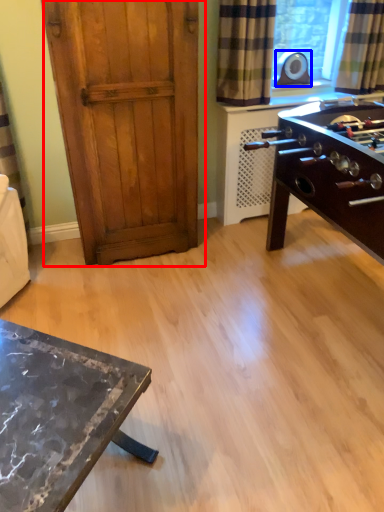
Question: Which object is further to the camera taking this photo, door (highlighted by a red box) or appliance (highlighted by a blue box)?

Choices:
 (A) door
 (B) appliance

Answer: (B)